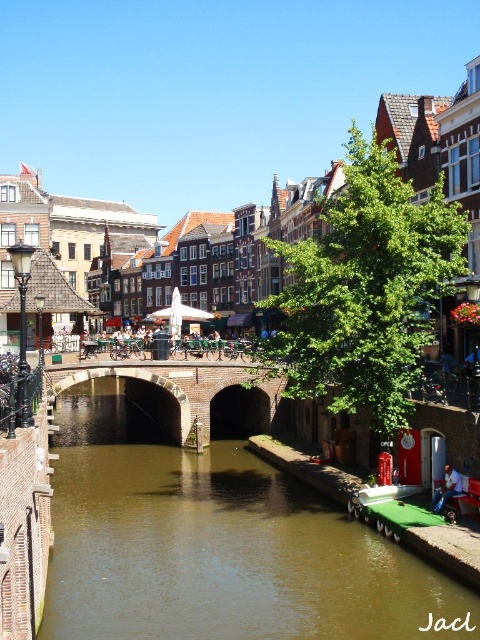
Looking at this image, you are a tourist in the city and want to cross the canal. You see the brick stone bridge at center and the blue denim jeans at lower right. Which object is bigger and can help you cross the canal?

The brick stone bridge at center is larger than the blue denim jeans at lower right, so it can help you cross the canal.

You are standing on the left bank of the canal and want to cross to the right side. The brick stone bridge at center is the only path. However, you notice the brown smooth water at center is reflecting the sky perfectly. Is the water surface closer to you than the bridge? If so, does this mean the bridge is partially blocking your view of the water?

The brown smooth water at center is closer to the viewer than the brick stone bridge at center. This means the bridge is not blocking your view of the water since the water is in front of the bridge.

You are standing on the stone bridge with two arches and want to take a photo of two points marked in the image. The first point is at coordinates point (251, 593) and the second is at point (431, 508). Which point should you focus on first if you want to capture both in a single shot without moving the camera?

You should focus on point (251, 593) first because it is closer to the camera than point (431, 508), ensuring both points remain in focus when using a single focal point.